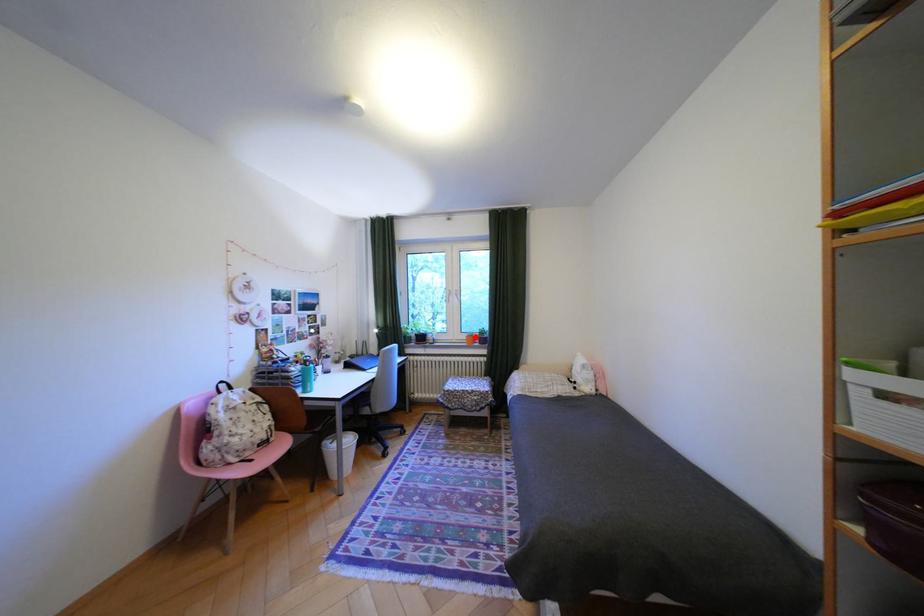
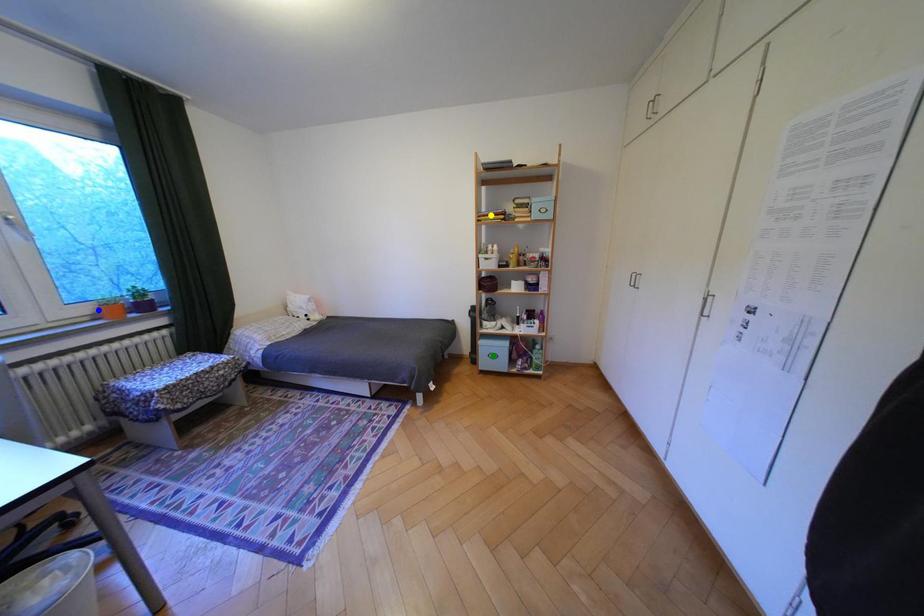
Question: I am providing you with two images of the same scene from different viewpoints. A red point is marked on the first image. You are given multiple points on the second image. Which point in image 2 is actually the same real-world point as the red point in image 1?

Choices:
 (A) yellow point
 (B) blue point
 (C) green point

Answer: (B)